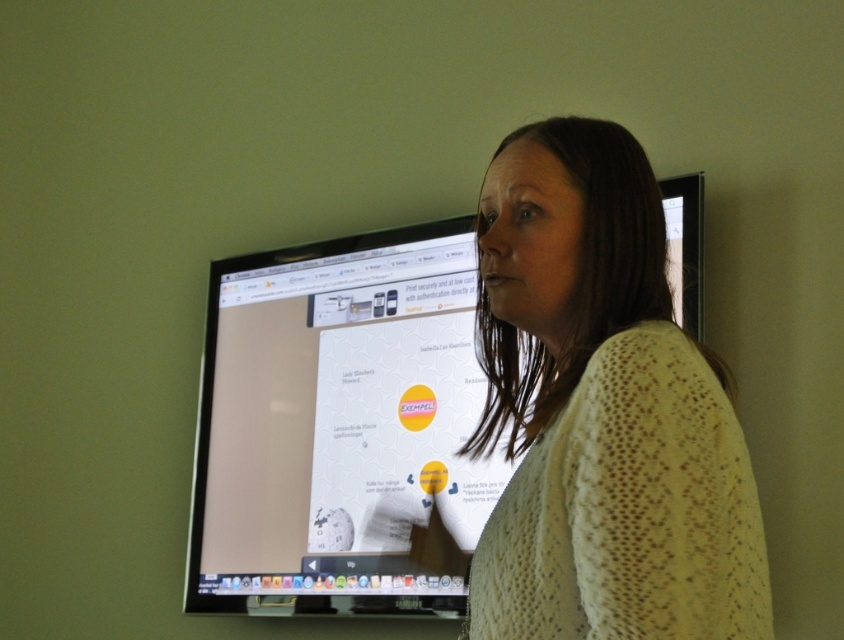
Between point (552, 595) and point (694, 180), which one is positioned in front?

Point (552, 595) is in front.

Between point (565, 632) and point (307, 276), which one is positioned behind?

The point (307, 276) is more distant.

What do you see at coordinates (602, 412) in the screenshot?
I see `knitted yellow sweater at center` at bounding box center [602, 412].

This screenshot has width=844, height=640. I want to click on knitted yellow sweater at center, so click(x=602, y=412).